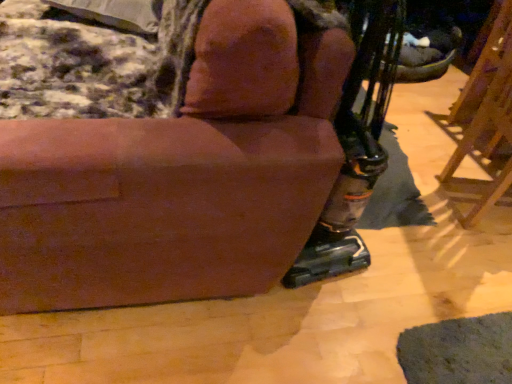
Question: Is brown fabric chair at center not inside brown wood easel at right?

Choices:
 (A) yes
 (B) no

Answer: (A)

Question: From a real-world perspective, is brown fabric chair at center located higher than brown wood easel at right?

Choices:
 (A) yes
 (B) no

Answer: (A)

Question: Could you tell me if brown fabric chair at center is turned towards brown wood easel at right?

Choices:
 (A) yes
 (B) no

Answer: (B)

Question: Does brown fabric chair at center have a smaller size compared to brown wood easel at right?

Choices:
 (A) yes
 (B) no

Answer: (B)

Question: From the image's perspective, is brown fabric chair at center on top of brown wood easel at right?

Choices:
 (A) no
 (B) yes

Answer: (B)

Question: Is point (217, 100) closer or farther from the camera than point (501, 119)?

Choices:
 (A) closer
 (B) farther

Answer: (A)

Question: Would you say brown fabric chair at center is to the left or to the right of brown wood easel at right in the picture?

Choices:
 (A) right
 (B) left

Answer: (B)

Question: Relative to brown wood easel at right, is brown fabric chair at center in front or behind?

Choices:
 (A) behind
 (B) front

Answer: (B)

Question: Looking at their shapes, would you say brown fabric chair at center is wider or thinner than brown wood easel at right?

Choices:
 (A) thin
 (B) wide

Answer: (B)

Question: Is velvety gray pillow at upper left to the left or to the right of brown wood easel at right in the image?

Choices:
 (A) left
 (B) right

Answer: (A)

Question: From the image's perspective, relative to brown wood easel at right, is velvety gray pillow at upper left above or below?

Choices:
 (A) above
 (B) below

Answer: (A)

Question: Do you think velvety gray pillow at upper left is within brown wood easel at right, or outside of it?

Choices:
 (A) outside
 (B) inside

Answer: (A)

Question: In terms of size, does velvety gray pillow at upper left appear bigger or smaller than brown wood easel at right?

Choices:
 (A) small
 (B) big

Answer: (A)

Question: In the image, is brown wood easel at right on the left side or the right side of brown fabric chair at center?

Choices:
 (A) right
 (B) left

Answer: (A)

Question: From a real-world perspective, relative to brown fabric chair at center, is brown wood easel at right vertically above or below?

Choices:
 (A) above
 (B) below

Answer: (B)